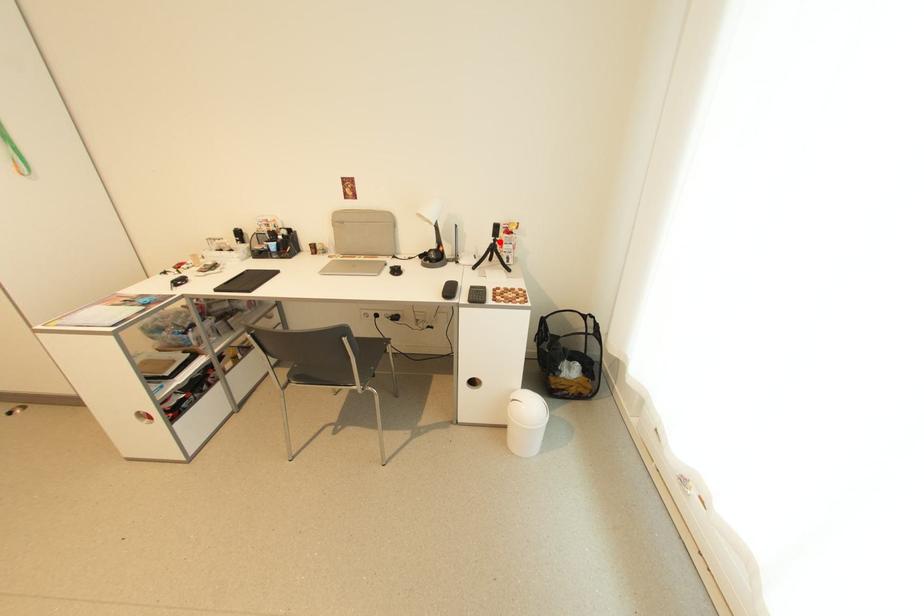
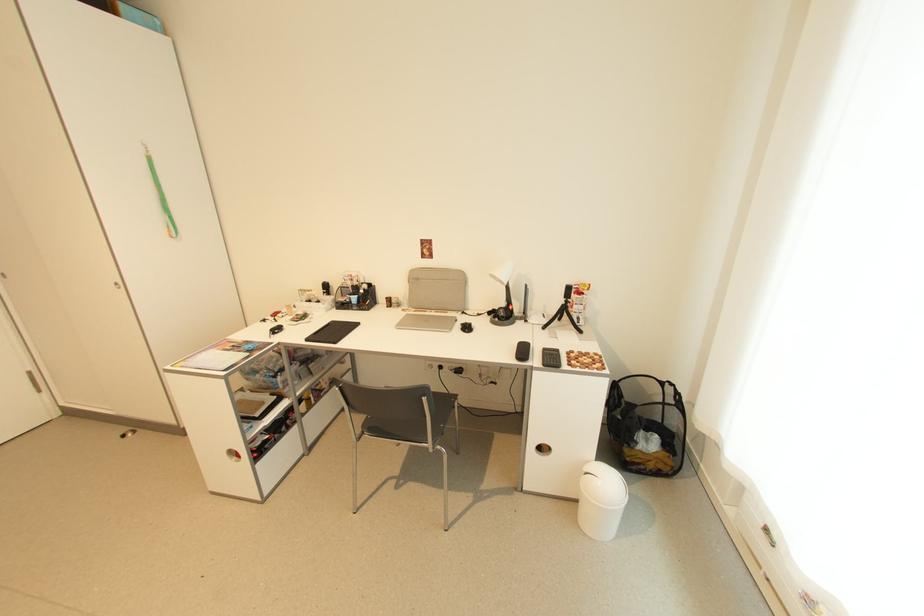
Find the pixel in the second image that matches the highlighted location in the first image.

(572, 302)